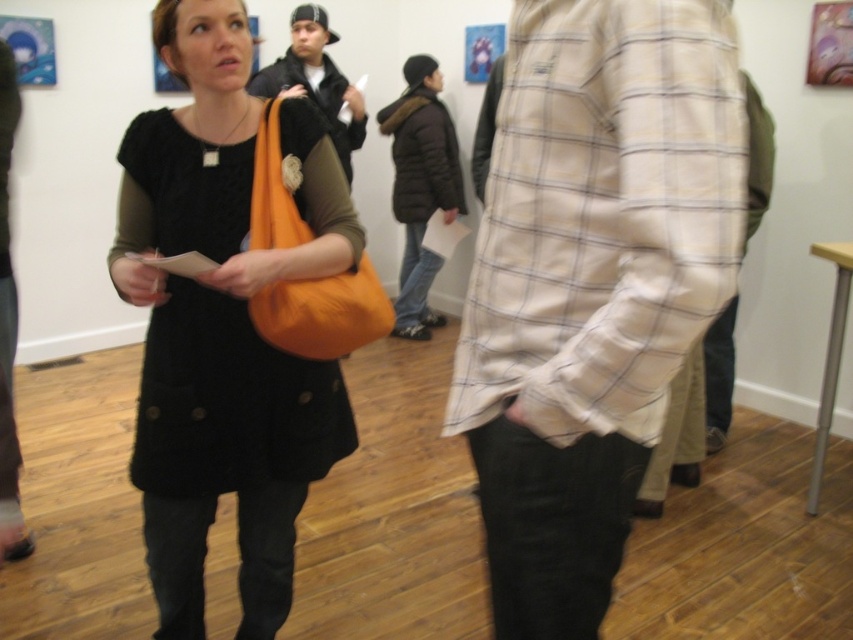
You are standing in the art gallery and want to move from point (701, 298) to point (351, 115). Which direction should you move to get closer to the woman standing off to the left?

You should move towards point (351, 115) because it is farther from the viewer compared to point (701, 298), which is closer. Since the woman is on the left, moving towards the farther point aligns with her position.

You are an event coordinator in the art gallery and need to arrange two items on a display stand. The items are the light beige plaid shirt at center and the matte black jacket at center. According to the current arrangement in the image, which item should be placed lower on the stand to match the existing setup?

The light beige plaid shirt at center should be placed lower on the stand because in the image, the light beige plaid shirt at center is located below the matte black jacket at center.

You are an artist trying to decide where to place your new sculpture in the gallery. The sculpture requires a space that is wider than the orange fabric bag at upper left but narrower than the matte black jacket at center. Is there a suitable location between these two objects?

The orange fabric bag at upper left is thinner than the matte black jacket at center, so there is a suitable width between them for placing the sculpture.